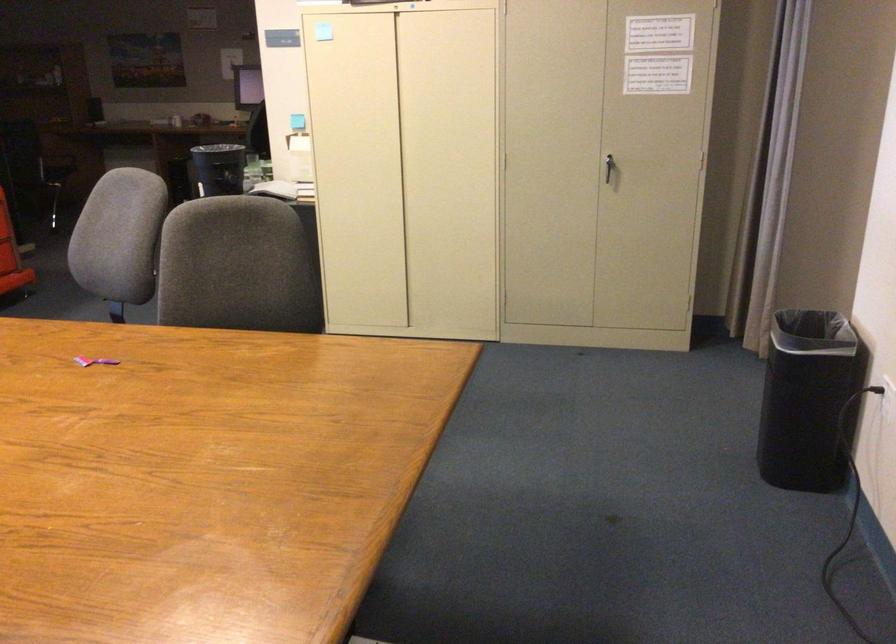
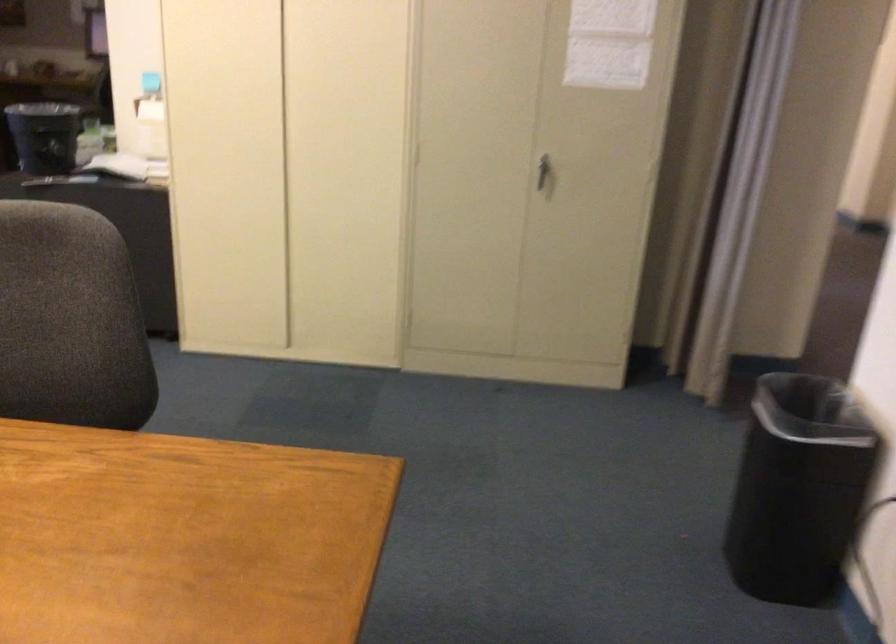
The point at [797,392] is marked in the first image. Where is the corresponding point in the second image?

(798, 489)